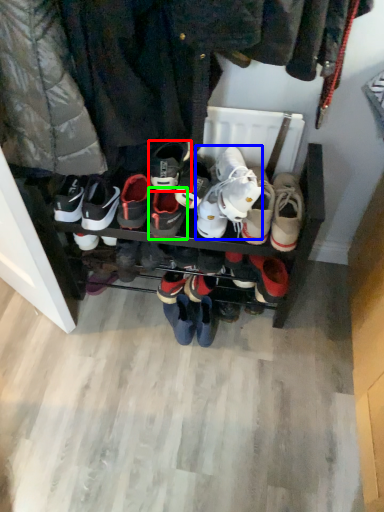
Question: Estimate the real-world distances between objects in this image. Which object is farther from footwear (highlighted by a red box), footwear (highlighted by a blue box) or footwear (highlighted by a green box)?

Choices:
 (A) footwear
 (B) footwear

Answer: (A)